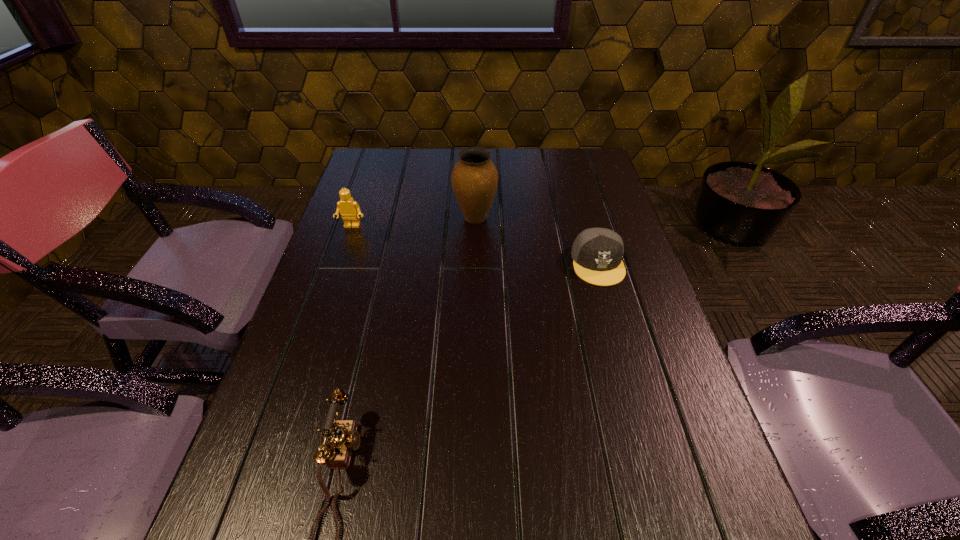
This screenshot has height=540, width=960. I want to click on vacant space at the far edge of the desktop, so click(x=516, y=180).

Identify the location of free space at the left edge of the desktop. (340, 221).

Identify the location of free space at the right edge of the desktop. (646, 300).

I want to click on free space at the far left corner, so click(365, 164).

Where is `free space at the far right corner of the desktop`? This screenshot has height=540, width=960. free space at the far right corner of the desktop is located at coordinates (583, 150).

Find the location of a particular element. This screenshot has width=960, height=540. free space between the urn and the leftmost object is located at coordinates (414, 222).

The image size is (960, 540). I want to click on free spot between the shortest object and the tallest object, so click(537, 241).

At what (x,y) coordinates should I click in order to perform the action: click on free spot between the tallest object and the Lego. Please return your answer as a coordinate pair (x, y). The width and height of the screenshot is (960, 540). Looking at the image, I should click on (414, 222).

Where is `free area in between the Lego and the third farthest object`? The image size is (960, 540). free area in between the Lego and the third farthest object is located at coordinates (475, 245).

Identify the location of vacant point located between the tallest object and the leftmost object. This screenshot has width=960, height=540. (414, 222).